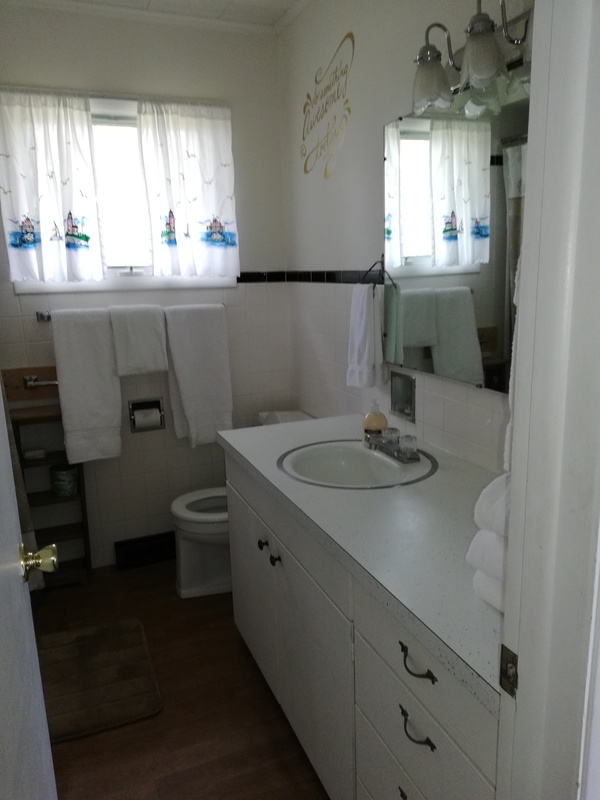
At what (x,y) coordinates should I click in order to perform the action: click on window. Please return your answer as a coordinate pair (x, y). The image size is (600, 800). Looking at the image, I should click on click(x=117, y=194).